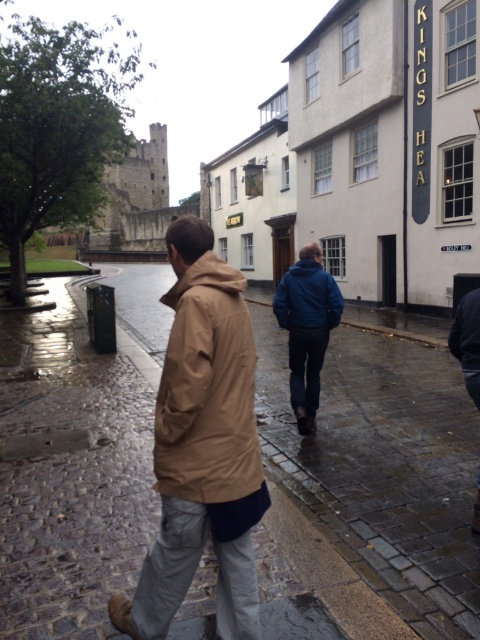
Is blue fabric jacket at center positioned behind dark blue jacket at lower right?

Yes, blue fabric jacket at center is behind dark blue jacket at lower right.

Between point (289, 376) and point (468, 381), which one is positioned behind?

The point (289, 376) is behind.

This screenshot has height=640, width=480. Identify the location of blue fabric jacket at center. (307, 328).

Does tan fabric trench coat at center appear on the right side of blue matte jacket at center?

Incorrect, tan fabric trench coat at center is not on the right side of blue matte jacket at center.

Does tan fabric trench coat at center appear on the left side of blue matte jacket at center?

Yes, tan fabric trench coat at center is to the left of blue matte jacket at center.

Is point (182, 582) positioned before point (312, 285)?

That is True.

Where is `tan fabric trench coat at center`? This screenshot has width=480, height=640. tan fabric trench coat at center is located at coordinates (203, 448).

Where is `blue fabric jacket at center`? The image size is (480, 640). blue fabric jacket at center is located at coordinates (307, 328).

Between blue fabric jacket at center and blue matte jacket at center, which one has less height?

Standing shorter between the two is blue fabric jacket at center.

Describe the element at coordinates (307, 328) in the screenshot. Image resolution: width=480 pixels, height=640 pixels. I see `blue fabric jacket at center` at that location.

This screenshot has height=640, width=480. In order to click on blue fabric jacket at center in this screenshot , I will do `click(307, 328)`.